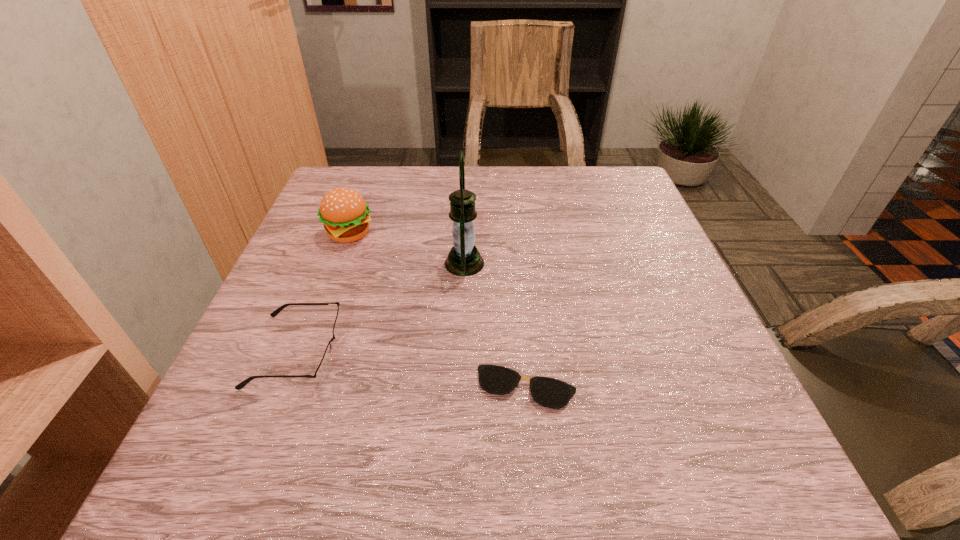
I want to click on empty space between the taller spectacles and the shortest object, so click(412, 369).

Locate an element on the screen. free area in between the second shortest object and the tallest object is located at coordinates 380,307.

I want to click on free space that is in between the hamburger and the lantern, so click(406, 248).

Identify the location of vacant area that lies between the left spectacles and the right spectacles. Image resolution: width=960 pixels, height=540 pixels. (412, 369).

You are a GUI agent. You are given a task and a screenshot of the screen. Output one action in this format:
    pyautogui.click(x=<x>, y=<y>)
    Task: Click on the vacant area between the lantern and the shortest object
    This screenshot has width=960, height=540.
    Given the screenshot: What is the action you would take?
    pyautogui.click(x=495, y=326)

Where is `free space that is in between the second tallest object and the shortest object`? This screenshot has height=540, width=960. free space that is in between the second tallest object and the shortest object is located at coordinates (438, 310).

Image resolution: width=960 pixels, height=540 pixels. Identify the location of blank region between the shortest object and the hamburger. (438, 310).

This screenshot has height=540, width=960. What are the coordinates of `unoccupied area between the tallest object and the right spectacles` in the screenshot? It's located at (495, 326).

This screenshot has width=960, height=540. I want to click on unoccupied area between the tallest object and the shortest object, so click(x=495, y=326).

Point out which object is positioned as the nearest to the shortest object. Please provide its 2D coordinates. Your answer should be formatted as a tuple, i.e. [(x, y)], where the tuple contains the x and y coordinates of a point satisfying the conditions above.

[(464, 259)]